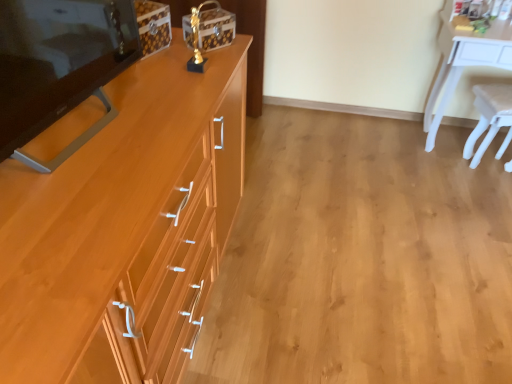
At what (x,y) coordinates should I click in order to perform the action: click on vacant area located to the right-hand side of matte wood changing table at left. Please return your answer as a coordinate pair (x, y). The height and width of the screenshot is (384, 512). Looking at the image, I should click on (156, 123).